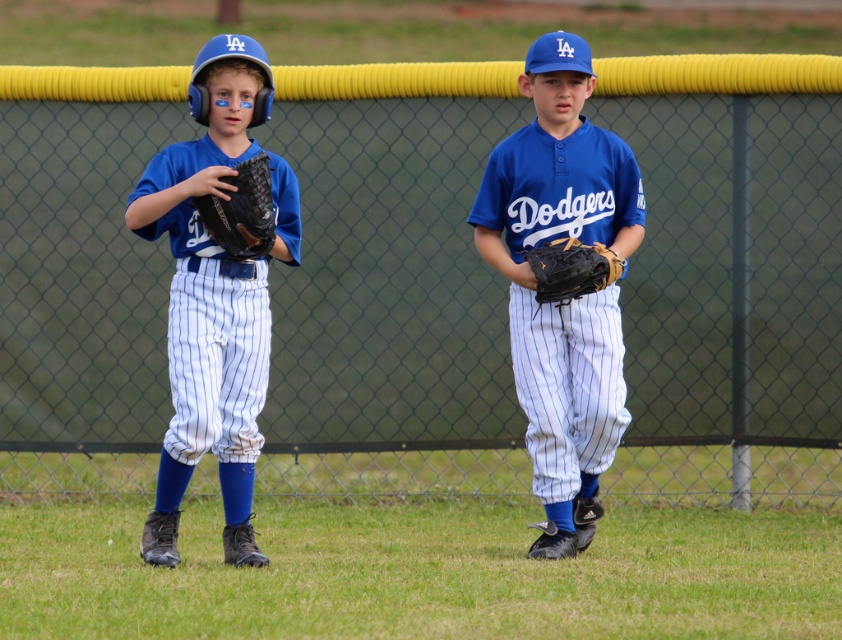
You are a coach on the field and want to retrieve both the matte blue baseball glove at left and the black leather glove at center. If your reach is 1.5 meters, can you grab both gloves without moving your feet?

The matte blue baseball glove at left is 1.43 meters from the black leather glove at center. Since your reach is 1.5 meters, you can grab both gloves without moving your feet because the distance between them is within your reach.